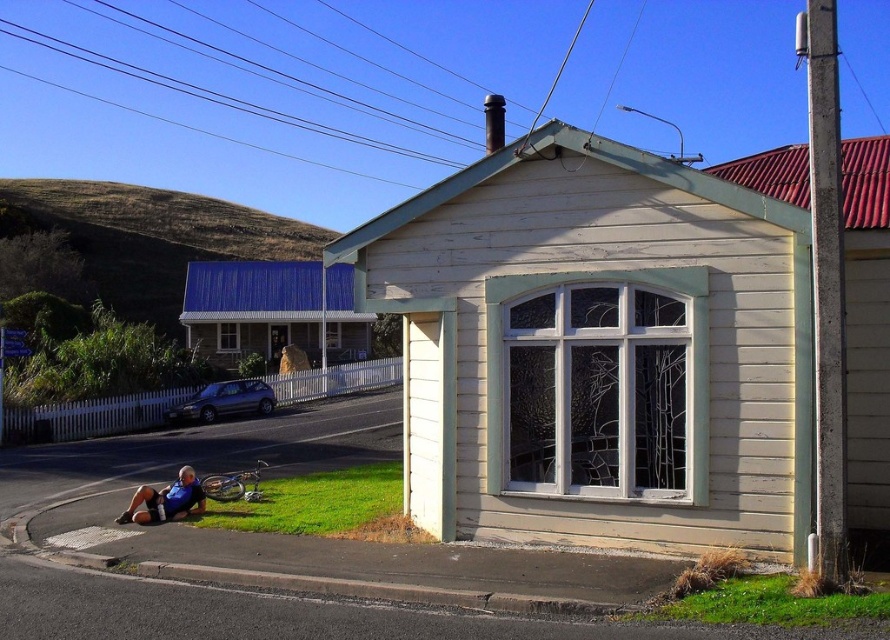
Does green grass at lower left come behind green grass at lower right?

Yes, it is behind green grass at lower right.

Is the position of green grass at lower left less distant than that of green grass at lower right?

No.

Which is behind, point (272, 513) or point (692, 595)?

The point (272, 513) is behind.

The image size is (890, 640). In order to click on green grass at lower left in this screenshot , I will do `click(321, 506)`.

Is point (751, 621) behind point (185, 506)?

No, (751, 621) is closer to viewer.

Is point (712, 620) closer to viewer compared to point (185, 468)?

Yes, it is.

The image size is (890, 640). Identify the location of green grass at lower right. (767, 604).

Between green grass at lower left and blue fabric shirt at lower left, which one is positioned lower?

Positioned lower is green grass at lower left.

Does green grass at lower left appear on the right side of blue fabric shirt at lower left?

Yes, green grass at lower left is to the right of blue fabric shirt at lower left.

Is point (328, 472) farther from viewer compared to point (174, 486)?

Yes, it is behind point (174, 486).

Find the location of a particular element. The width and height of the screenshot is (890, 640). green grass at lower left is located at coordinates (321, 506).